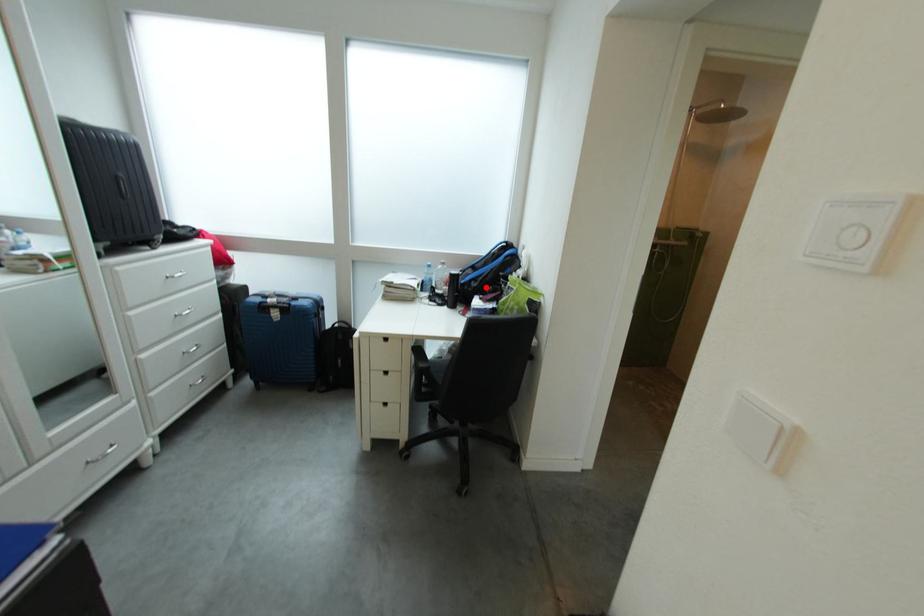
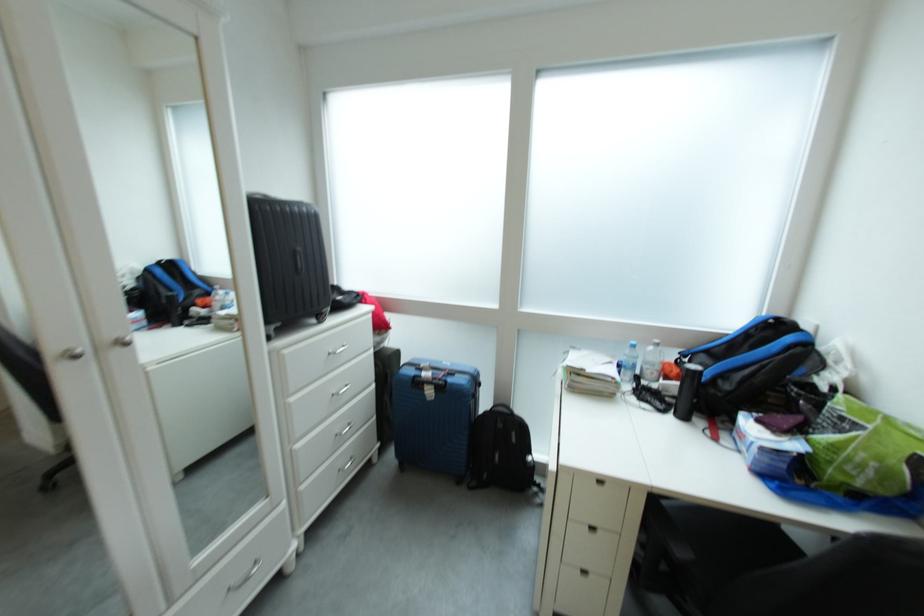
Find the pixel in the second image that matches the highlighted location in the first image.

(737, 390)